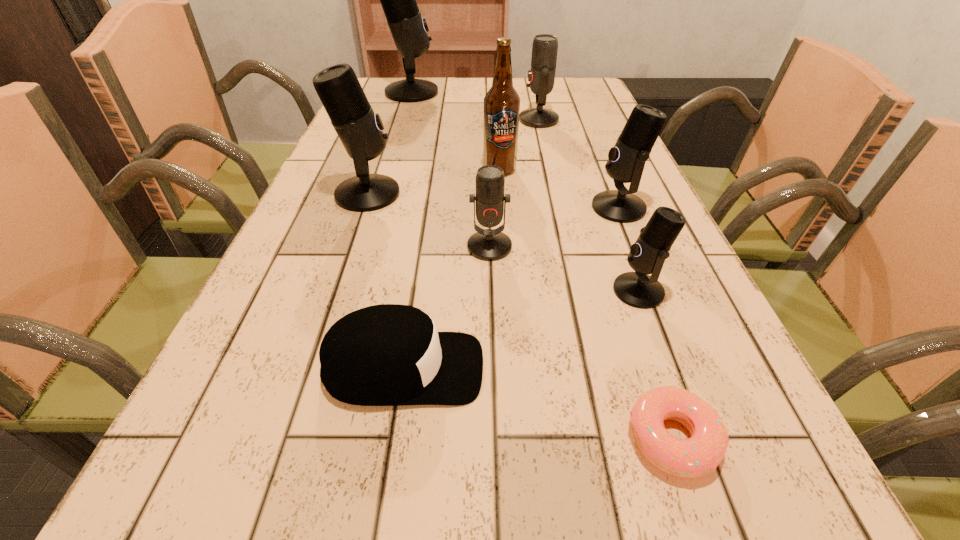
You are a GUI agent. You are given a task and a screenshot of the screen. Output one action in this format:
    pyautogui.click(x=<x>, y=<y>)
    Task: Click on the object that is at the far edge
    This screenshot has height=540, width=960.
    Given the screenshot: What is the action you would take?
    pyautogui.click(x=409, y=29)

Identify the location of cap located at the left edge. This screenshot has width=960, height=540. (389, 354).

I want to click on doughnut located at the right edge, so click(x=702, y=453).

The width and height of the screenshot is (960, 540). In order to click on object present at the far left corner in this screenshot , I will do `click(409, 29)`.

Locate an element on the screen. The width and height of the screenshot is (960, 540). vacant space at the far edge of the desktop is located at coordinates (489, 79).

You are a GUI agent. You are given a task and a screenshot of the screen. Output one action in this format:
    pyautogui.click(x=<x>, y=<y>)
    Task: Click on the vacant space at the left edge
    The height and width of the screenshot is (540, 960).
    Given the screenshot: What is the action you would take?
    pyautogui.click(x=324, y=329)

What are the coordinates of `vacant space at the right edge of the desktop` in the screenshot? It's located at (575, 154).

In the image, there is a desktop. Where is `free space at the far right corner`? The image size is (960, 540). free space at the far right corner is located at coordinates (581, 99).

I want to click on vacant space that's between the beer bottle and the third biggest black microphone, so click(x=559, y=188).

You are a GUI agent. You are given a task and a screenshot of the screen. Output one action in this format:
    pyautogui.click(x=<x>, y=<y>)
    Task: Click on the vacant space that is in between the third biggest black microphone and the nearest microphone
    This screenshot has width=960, height=540.
    Given the screenshot: What is the action you would take?
    pyautogui.click(x=629, y=249)